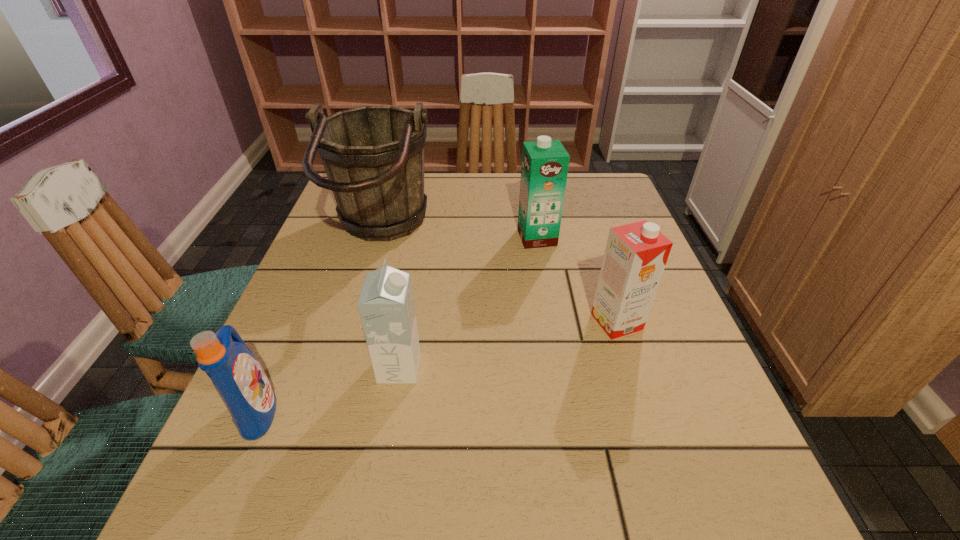
Identify the location of the closest object to the detergent. pos(386,306).

This screenshot has height=540, width=960. I want to click on the second closest carton relative to the second nearest carton, so click(386, 306).

Select which carton is the closest to the farthest carton. Please provide its 2D coordinates. Your answer should be formatted as a tuple, i.e. [(x, y)], where the tuple contains the x and y coordinates of a point satisfying the conditions above.

[(636, 254)]

This screenshot has height=540, width=960. I want to click on free point that satisfies the following two spatial constraints: 1. on the back side of the second carton from left to right; 2. on the handle side of the bucket, so click(x=537, y=233).

Identify the location of free space that satisfies the following two spatial constraints: 1. on the handle side of the bucket; 2. on the back side of the second carton from left to right. The image size is (960, 540). 379,238.

Where is `vacant space that satisfies the following two spatial constraints: 1. on the handle side of the farthest carton; 2. on the right side of the bucket`? Image resolution: width=960 pixels, height=540 pixels. vacant space that satisfies the following two spatial constraints: 1. on the handle side of the farthest carton; 2. on the right side of the bucket is located at coordinates (379, 238).

Locate an element on the screen. blank area in the image that satisfies the following two spatial constraints: 1. on the front side of the rightmost object; 2. on the label of the detergent is located at coordinates (645, 410).